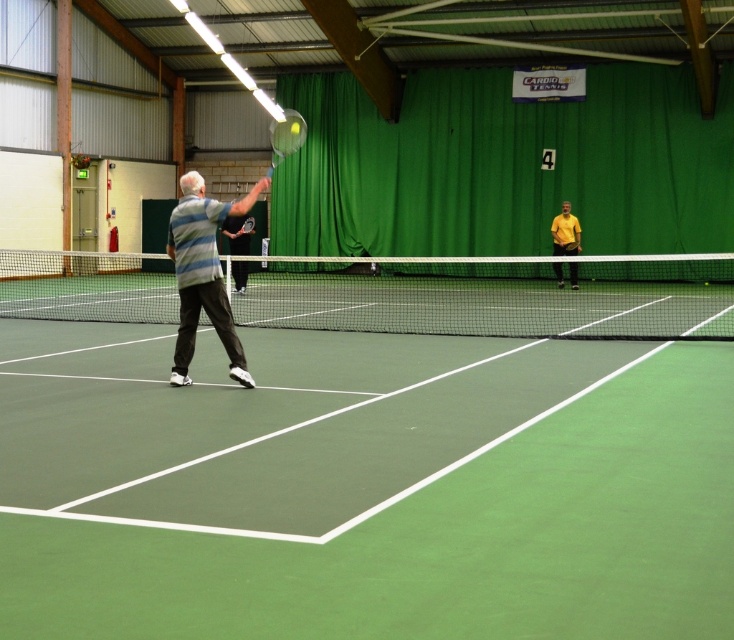
You are standing at the center of the indoor tennis court and see two points marked on the court surface. Which point is closer to you, point (92,612) or point (498,266)?

Point (92,612) is closer to the viewer than point (498,266).

Consider the image. You are a tennis player standing at the baseline of the court. You notice the metallic silver tennis racket at upper center and the matte gray shirt at center. Which object is nearer to you?

The metallic silver tennis racket at upper center is closer to the viewer than the matte gray shirt at center, so it is nearer to you.

You are a tennis ball that just bounced on the court. You need to decide whether to roll toward the striped cotton shirt at center or the yellow matte shirt at center. Which direction should you go to be closer to the other shirt?

The striped cotton shirt at center and yellow matte shirt at center are 15.24 meters apart. Since the tennis ball is equidistant from both shirts, it can roll toward either one and will be equally close to the other shirt.